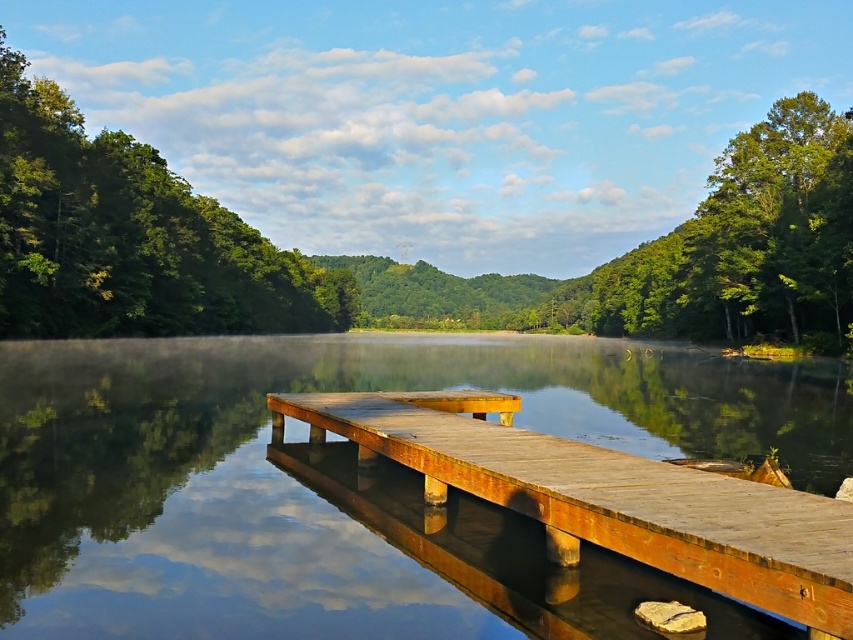
You are standing on the wooden dock and want to walk towards the point labeled as point (x=564, y=452). As you move forward, will the point labeled point (x=717, y=172) become visible or hidden from your view?

Point (x=717, y=172) is behind point (x=564, y=452), so as you walk towards point (x=564, y=452), the point (x=717, y=172) will become hidden from your view once you pass that point.

You are standing at the lakeside and want to know how far the point at coordinates (107, 225) is from you. Can you determine the distance?

The distance of point (107, 225) from camera is 65.73 meters, so the point is 65.73 meters away from you.

You are standing at the point with coordinates point (502, 432) and want to walk towards the point (24, 296). Which direction should you face to walk directly towards it?

To walk directly towards point (24, 296) from point (502, 432), you should face the direction opposite of point (24, 296) since it is behind point (502, 432).